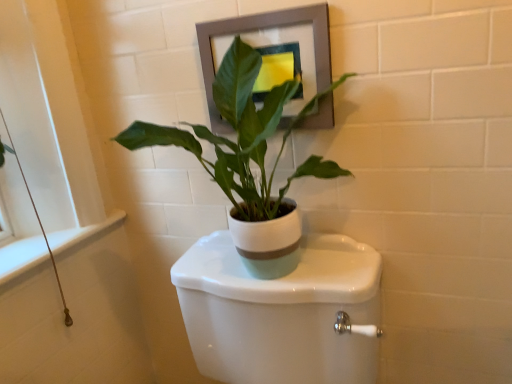
Question: Does white matte pot at center have a lesser height compared to white glossy toilet at center?

Choices:
 (A) no
 (B) yes

Answer: (B)

Question: Is white matte pot at center smaller than white glossy toilet at center?

Choices:
 (A) no
 (B) yes

Answer: (B)

Question: Does white matte pot at center have a larger size compared to white glossy toilet at center?

Choices:
 (A) yes
 (B) no

Answer: (B)

Question: Are white matte pot at center and white glossy toilet at center located far from each other?

Choices:
 (A) yes
 (B) no

Answer: (B)

Question: From a real-world perspective, does white matte pot at center sit lower than white glossy toilet at center?

Choices:
 (A) yes
 (B) no

Answer: (B)

Question: From the image's perspective, is white matte pot at center on white glossy toilet at center?

Choices:
 (A) no
 (B) yes

Answer: (B)

Question: Is matte gray picture frame at upper center positioned far away from white glossy toilet at center?

Choices:
 (A) yes
 (B) no

Answer: (B)

Question: Is matte gray picture frame at upper center looking in the opposite direction of white glossy toilet at center?

Choices:
 (A) no
 (B) yes

Answer: (A)

Question: Can you confirm if matte gray picture frame at upper center is positioned to the left of white glossy toilet at center?

Choices:
 (A) yes
 (B) no

Answer: (B)

Question: Does matte gray picture frame at upper center appear on the right side of white glossy toilet at center?

Choices:
 (A) no
 (B) yes

Answer: (B)

Question: Is matte gray picture frame at upper center aimed at white glossy toilet at center?

Choices:
 (A) yes
 (B) no

Answer: (B)

Question: Can you confirm if matte gray picture frame at upper center is smaller than white glossy toilet at center?

Choices:
 (A) yes
 (B) no

Answer: (A)

Question: From the image's perspective, is white glossy toilet at center below matte gray picture frame at upper center?

Choices:
 (A) no
 (B) yes

Answer: (B)